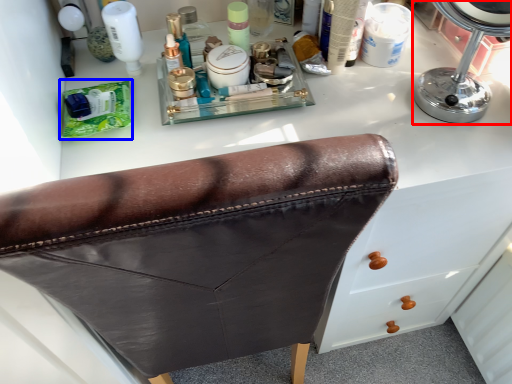
Question: Which object is closer to the camera taking this photo, mirror (highlighted by a red box) or product (highlighted by a blue box)?

Choices:
 (A) mirror
 (B) product

Answer: (A)